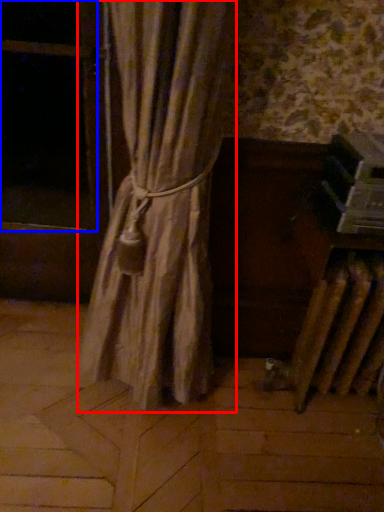
Question: Which object appears closest to the camera in this image, curtain (highlighted by a red box) or window screen (highlighted by a blue box)?

Choices:
 (A) curtain
 (B) window screen

Answer: (A)